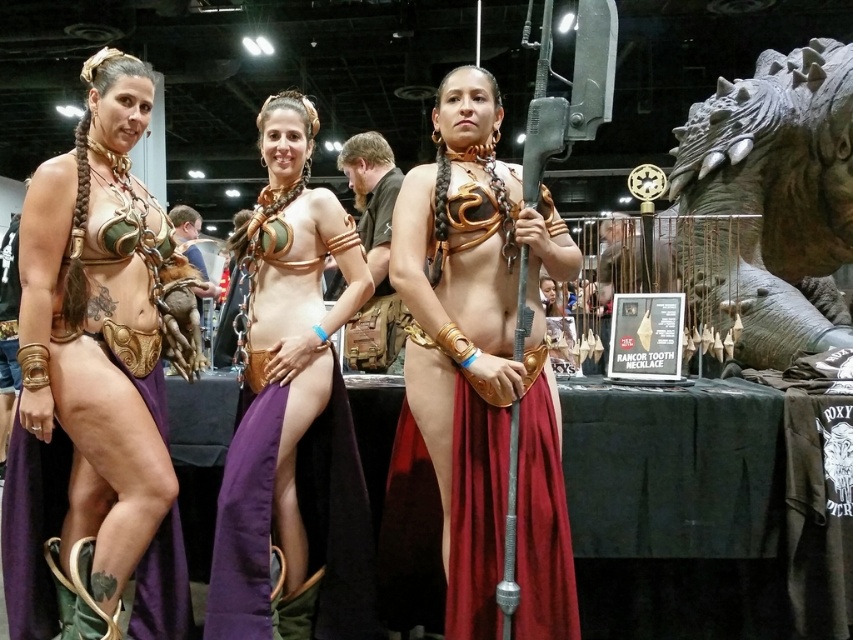
Question: Which point is farther to the camera?

Choices:
 (A) (448, 589)
 (B) (85, 460)
 (C) (804, 346)
 (D) (303, 365)

Answer: (C)

Question: Observing the image, what is the correct spatial positioning of metallic gold armor at center in reference to matte gold bikini top at center?

Choices:
 (A) right
 (B) left

Answer: (A)

Question: Can you confirm if metallic gold armor at center is wider than gray stone dragon head at upper right?

Choices:
 (A) yes
 (B) no

Answer: (B)

Question: Which object appears closest to the camera in this image?

Choices:
 (A) matte gold bikini top at center
 (B) gold metallic armor at left
 (C) metallic gold armor at center
 (D) gray stone dragon head at upper right

Answer: (C)

Question: Does metallic gold armor at center appear under matte gold bikini top at center?

Choices:
 (A) yes
 (B) no

Answer: (B)

Question: Based on their relative distances, which object is farther from the gray stone dragon head at upper right?

Choices:
 (A) gold metallic armor at left
 (B) matte gold bikini top at center

Answer: (A)